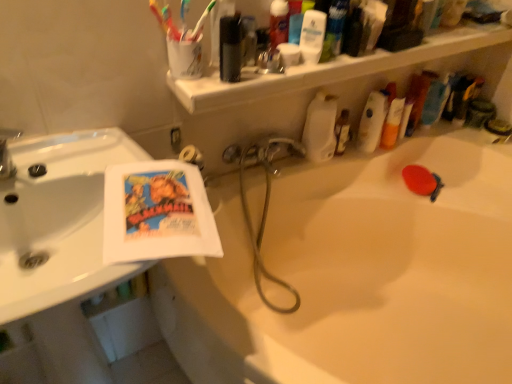
Question: From a real-world perspective, is black rubber hose at center on top of metallic silver soap dispenser at upper right, which is counted as the 2th toiletry, starting from the left?

Choices:
 (A) no
 (B) yes

Answer: (A)

Question: From a real-world perspective, is black rubber hose at center located beneath metallic silver soap dispenser at upper right, which is counted as the 2th toiletry, starting from the left?

Choices:
 (A) yes
 (B) no

Answer: (A)

Question: Is black rubber hose at center turned away from metallic silver soap dispenser at upper right, the 1th toiletry from the right?

Choices:
 (A) no
 (B) yes

Answer: (A)

Question: Considering the relative positions of black rubber hose at center and metallic silver soap dispenser at upper right, which is counted as the 2th toiletry, starting from the left, in the image provided, is black rubber hose at center in front of metallic silver soap dispenser at upper right, which is counted as the 2th toiletry, starting from the left,?

Choices:
 (A) no
 (B) yes

Answer: (B)

Question: From the image's perspective, is black rubber hose at center beneath metallic silver soap dispenser at upper right, the 1th toiletry from the right?

Choices:
 (A) yes
 (B) no

Answer: (A)

Question: Is black rubber hose at center far away from metallic silver soap dispenser at upper right, which is counted as the 2th toiletry, starting from the left?

Choices:
 (A) yes
 (B) no

Answer: (B)

Question: Is blue plastic toothbrush at upper right, the 2th toiletry in the right-to-left sequence, further to camera compared to white glossy sink at upper left?

Choices:
 (A) no
 (B) yes

Answer: (B)

Question: Considering the relative sizes of blue plastic toothbrush at upper right, which is counted as the 1th toiletry, starting from the left, and white glossy sink at upper left in the image provided, is blue plastic toothbrush at upper right, which is counted as the 1th toiletry, starting from the left, wider than white glossy sink at upper left?

Choices:
 (A) no
 (B) yes

Answer: (A)

Question: Is blue plastic toothbrush at upper right, the 2th toiletry in the right-to-left sequence, in contact with white glossy sink at upper left?

Choices:
 (A) yes
 (B) no

Answer: (B)

Question: Is blue plastic toothbrush at upper right, the 2th toiletry in the right-to-left sequence, to the right of white glossy sink at upper left from the viewer's perspective?

Choices:
 (A) no
 (B) yes

Answer: (B)

Question: Is blue plastic toothbrush at upper right, which is counted as the 1th toiletry, starting from the left, at the left side of white glossy sink at upper left?

Choices:
 (A) no
 (B) yes

Answer: (A)

Question: Is blue plastic toothbrush at upper right, the 2th toiletry in the right-to-left sequence, closer to camera compared to white glossy sink at upper left?

Choices:
 (A) yes
 (B) no

Answer: (B)

Question: From a real-world perspective, is white plastic shelf at upper center over metallic silver soap dispenser at upper right, which is counted as the 2th toiletry, starting from the left?

Choices:
 (A) no
 (B) yes

Answer: (B)